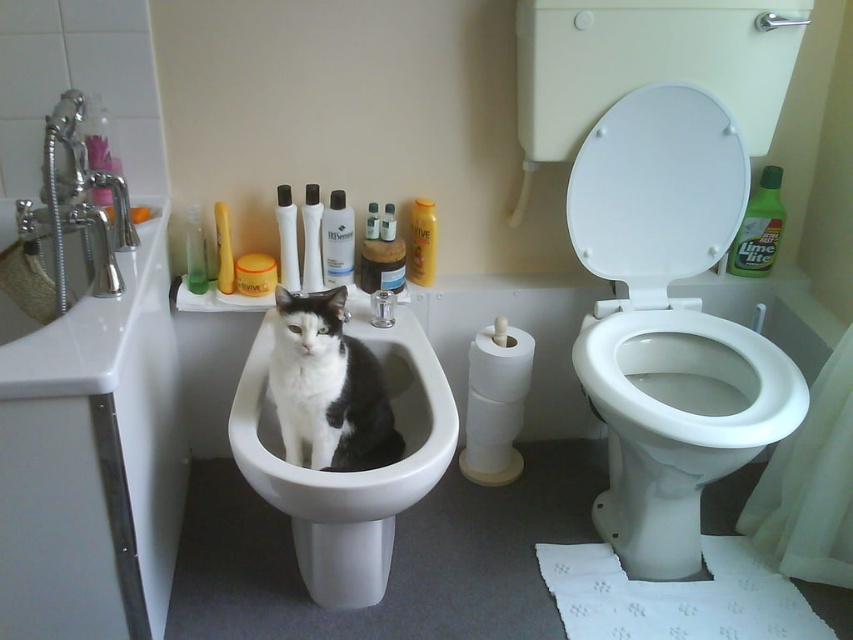
Between translucent plastic bottle at left and translucent plastic bottle at upper left, which one has less height?

translucent plastic bottle at left is shorter.

From the picture: Between translucent plastic bottle at left and translucent plastic bottle at upper left, which one is positioned higher?

translucent plastic bottle at left is higher up.

Measure the distance between point (189, 253) and camera.

Point (189, 253) is 5.15 feet from camera.

This screenshot has width=853, height=640. In order to click on translucent plastic bottle at left in this screenshot , I will do `click(195, 250)`.

Based on the photo, is white matte toilet paper at lower center taller than translucent plastic bottle at left?

Yes, white matte toilet paper at lower center is taller than translucent plastic bottle at left.

Is point (479, 408) positioned after point (190, 209)?

That is True.

You are a GUI agent. You are given a task and a screenshot of the screen. Output one action in this format:
    pyautogui.click(x=<x>, y=<y>)
    Task: Click on the white matte toilet paper at lower center
    This screenshot has height=640, width=853.
    Given the screenshot: What is the action you would take?
    pyautogui.click(x=495, y=403)

Between point (305, 188) and point (367, 230), which one is positioned behind?

The point (305, 188) is behind.

Between point (310, 262) and point (372, 230), which one is positioned behind?

Positioned behind is point (310, 262).

Where is `white plastic bottle at center`? white plastic bottle at center is located at coordinates (311, 240).